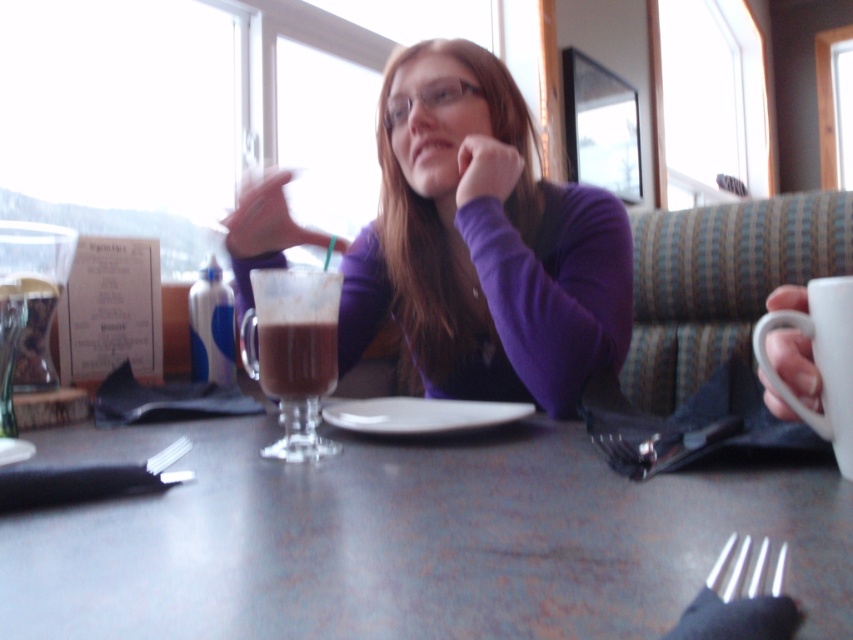
Question: Observing the image, what is the correct spatial positioning of purple matte shirt at center in reference to white ceramic mug at right?

Choices:
 (A) left
 (B) right

Answer: (A)

Question: Is white glossy plate at center closer to camera compared to purple matte hand at center?

Choices:
 (A) yes
 (B) no

Answer: (A)

Question: Which point is farther to the camera?

Choices:
 (A) pos(779,564)
 (B) pos(305,316)
 (C) pos(167,452)
 (D) pos(18,388)

Answer: (D)

Question: Considering the relative positions of purple matte shirt at center and white ceramic mug at right in the image provided, where is purple matte shirt at center located with respect to white ceramic mug at right?

Choices:
 (A) above
 (B) below

Answer: (A)

Question: Based on their relative distances, which object is nearer to the white glossy plate at center?

Choices:
 (A) white glossy cup at right
 (B) translucent glass cup at left
 (C) silver metallic fork at lower right
 (D) purple matte shirt at center

Answer: (D)

Question: Which of the following is the farthest from the observer?

Choices:
 (A) (810, 284)
 (B) (47, 307)
 (C) (527, 595)
 (D) (395, 81)

Answer: (D)